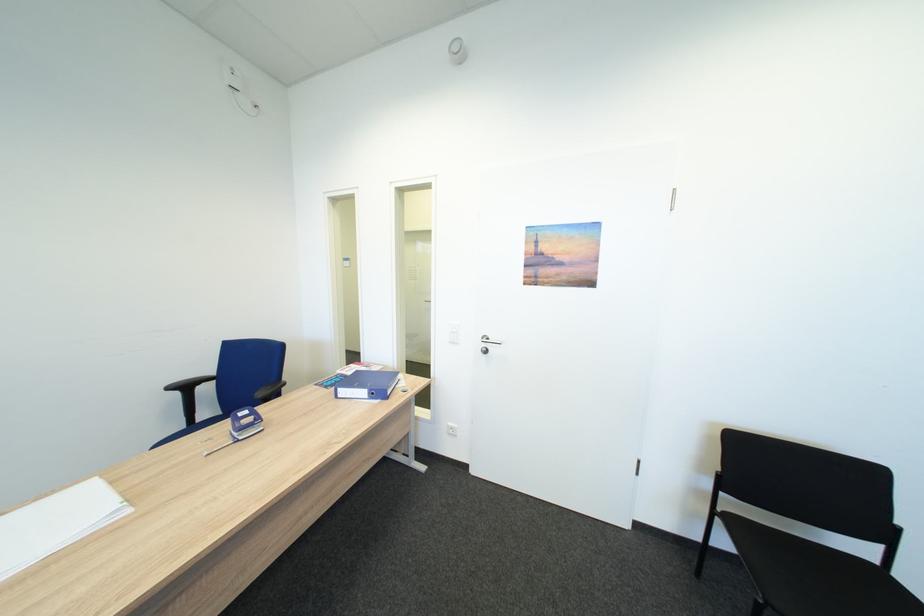
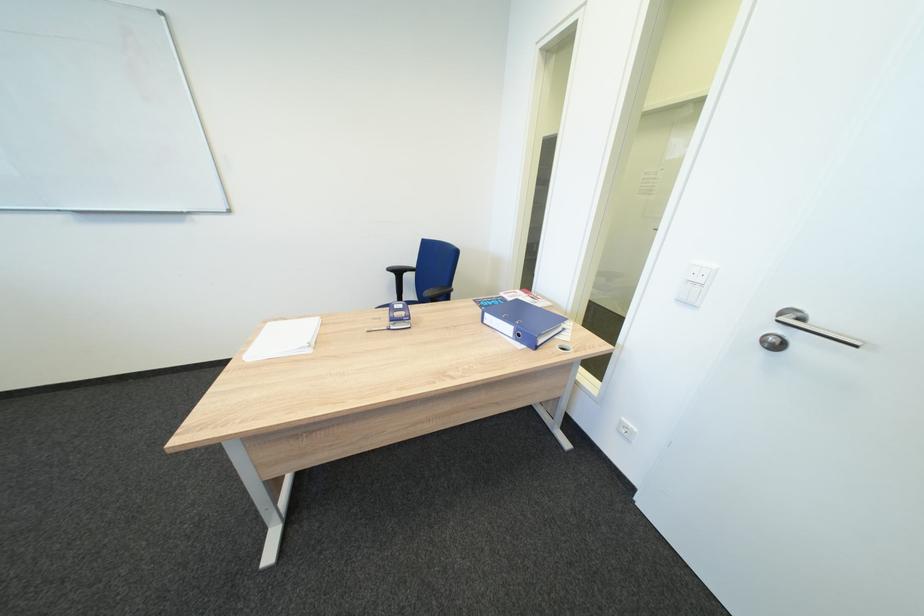
In the second image, find the point that corresponds to (x=349, y=398) in the first image.

(495, 323)